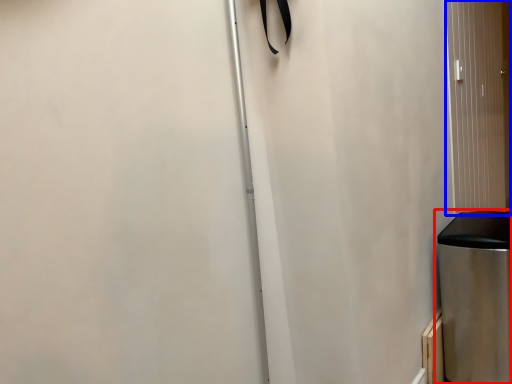
Question: Which object appears closest to the camera in this image, waste container (highlighted by a red box) or screen door (highlighted by a blue box)?

Choices:
 (A) waste container
 (B) screen door

Answer: (A)